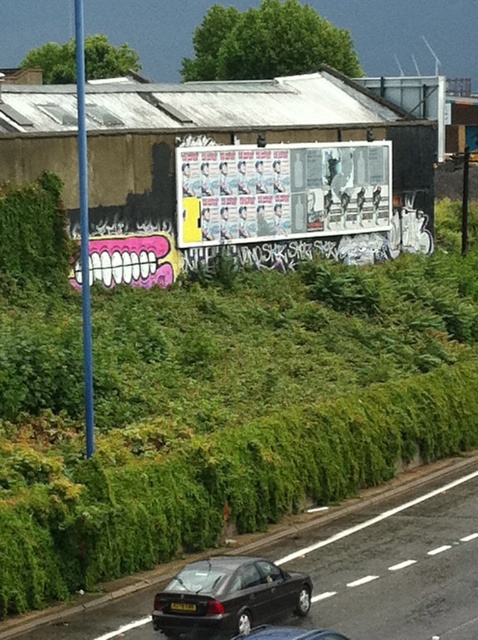
Can you confirm if green leafy tree at upper center is shorter than shiny black sedan at lower center?

In fact, green leafy tree at upper center may be taller than shiny black sedan at lower center.

Which is in front, point (272, 3) or point (195, 577)?

Positioned in front is point (195, 577).

At what (x,y) coordinates should I click in order to perform the action: click on green leafy tree at upper center. Please return your answer as a coordinate pair (x, y). This screenshot has width=478, height=640. Looking at the image, I should click on (267, 44).

Where is `green leafy tree at upper center`? green leafy tree at upper center is located at coordinates (267, 44).

Measure the distance between green leafy hedge at upper center and black car at lower center.

green leafy hedge at upper center is 4.26 meters away from black car at lower center.

At what (x,y) coordinates should I click in order to perform the action: click on green leafy hedge at upper center. Please return your answer as a coordinate pair (x, y). Image resolution: width=478 pixels, height=640 pixels. Looking at the image, I should click on (219, 408).

Who is higher up, green leafy hedge at upper center or shiny black sedan at center?

green leafy hedge at upper center

Is point (162, 552) closer to camera compared to point (237, 637)?

No, (162, 552) is further to viewer.

Is point (423, 406) farther from camera compared to point (256, 632)?

Yes, it is behind point (256, 632).

I want to click on green leafy hedge at upper center, so click(x=219, y=408).